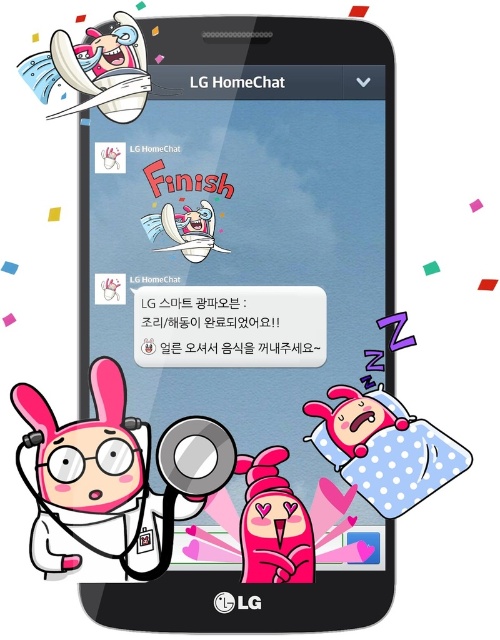
You are designing a poster and need to place the polka dot fabric pillow at lower right and the pink matte heart at center. According to the image, which object is located to the right of the other?

The polka dot fabric pillow at lower right is positioned on the right side of pink matte heart at center.

What is the spatial relationship between the polka dot fabric pillow at lower right and the white glossy rabbit at center in terms of size?

The polka dot fabric pillow at lower right has a larger size compared to the white glossy rabbit at center.